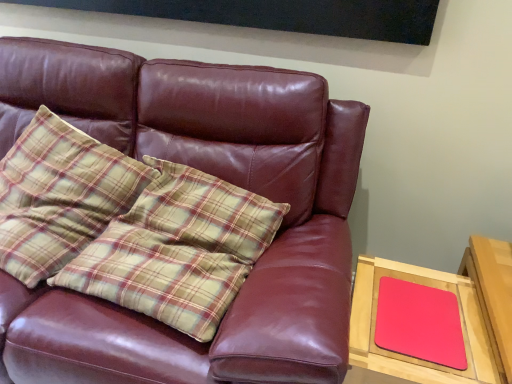
Question: Is matte leather couch at center to the left or to the right of plaid fabric pillow at left in the image?

Choices:
 (A) left
 (B) right

Answer: (B)

Question: In terms of size, does matte leather couch at center appear bigger or smaller than plaid fabric pillow at left?

Choices:
 (A) small
 (B) big

Answer: (B)

Question: Estimate the real-world distances between objects in this image. Which object is farther from the matte pink mousepad at right?

Choices:
 (A) matte leather couch at center
 (B) matte pink mousepad at right
 (C) plaid fabric pillow at left

Answer: (C)

Question: Considering the real-world distances, which object is farthest from the matte pink mousepad at right?

Choices:
 (A) matte leather couch at center
 (B) matte pink mousepad at right
 (C) plaid fabric pillow at left

Answer: (C)